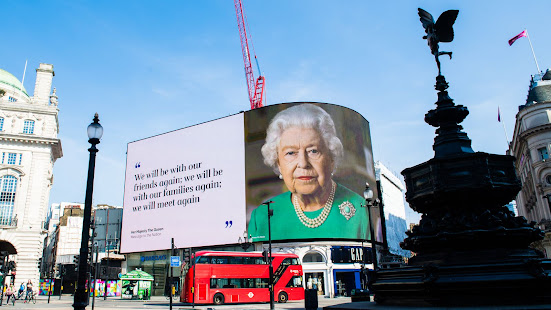
Identify the location of clothing store. This screenshot has width=551, height=310. (356, 255), (156, 259).